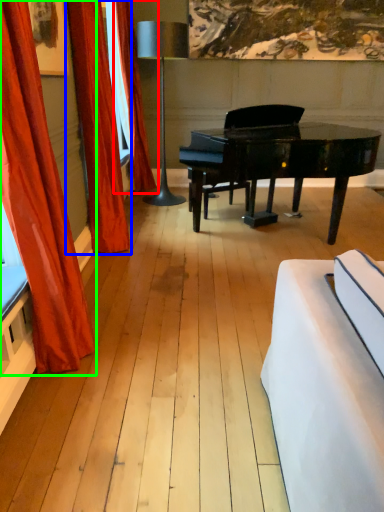
Question: Estimate the real-world distances between objects in this image. Which object is closer to curtain (highlighted by a red box), curtain (highlighted by a blue box) or curtain (highlighted by a green box)?

Choices:
 (A) curtain
 (B) curtain

Answer: (A)